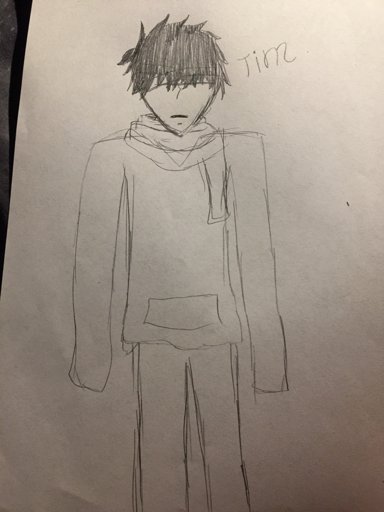
The image size is (384, 512). I want to click on shadow of paper on table, so click(x=17, y=58).